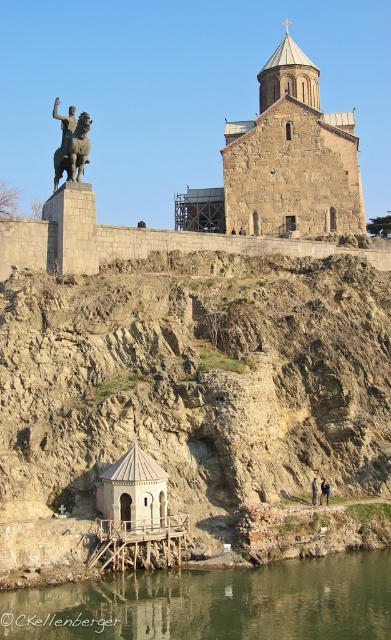
Is greenish water at lower center bigger than brown stone church at upper center?

Actually, greenish water at lower center might be smaller than brown stone church at upper center.

Who is taller, greenish water at lower center or brown stone church at upper center?

brown stone church at upper center is taller.

In order to click on greenish water at lower center in this screenshot , I will do `click(213, 604)`.

Where is `greenish water at lower center`? The width and height of the screenshot is (391, 640). greenish water at lower center is located at coordinates (213, 604).

Can you confirm if brown rocky hillside at center is positioned to the right of dark brown leather jacket at lower center?

Incorrect, brown rocky hillside at center is not on the right side of dark brown leather jacket at lower center.

Is brown rocky hillside at center below dark brown leather jacket at lower center?

Incorrect, brown rocky hillside at center is not positioned below dark brown leather jacket at lower center.

At what (x,y) coordinates should I click in order to perform the action: click on brown rocky hillside at center. Please return your answer as a coordinate pair (x, y). Looking at the image, I should click on (190, 388).

You are a GUI agent. You are given a task and a screenshot of the screen. Output one action in this format:
    pyautogui.click(x=<x>, y=<y>)
    Task: Click on the brown rocky hillside at center
    The height and width of the screenshot is (640, 391).
    Given the screenshot: What is the action you would take?
    pyautogui.click(x=190, y=388)

Is point (258, 195) positioned after point (313, 476)?

Yes.

Identify the location of brown stone church at upper center. (292, 156).